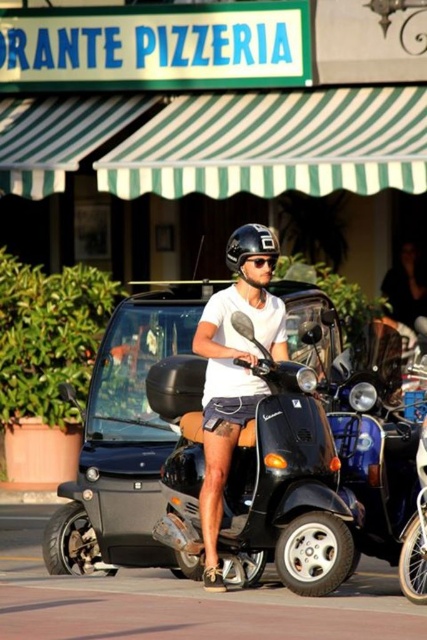
You are standing at the entrance of RANTE PIZZERIA and see the point marked at coordinates (x=382, y=458). What object is this point located on?

The point marked at coordinates (x=382, y=458) is located on the shiny black scooter at center.

You are a delivery person who needs to choose between the two scooters in front of the RANTE PIZZERIA. The black matte scooter at center and the shiny black scooter at center are both available. If you want to pick the larger one for carrying heavy packages, which scooter should you choose?

The shiny black scooter at center is larger than the black matte scooter at center, so you should choose the shiny black scooter at center for carrying heavy packages.

You are standing at the entrance of RANTE PIZZERIA and want to take a photo of the black matte scooter at center. Where should you position yourself to capture it in the frame?

To capture the black matte scooter at center in the frame, position yourself at the entrance of RANTE PIZZERIA and aim your camera towards the coordinates point (x=286, y=486) where the scooter is located.